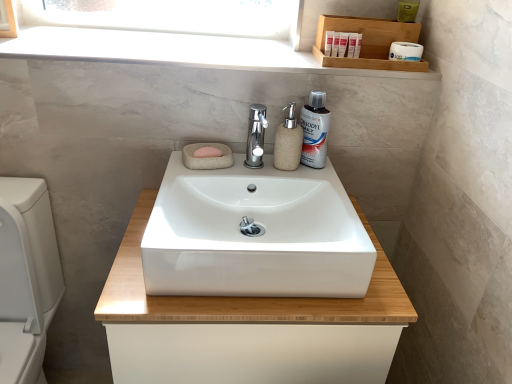
Find the location of a particular element. This screenshot has height=384, width=512. blank space to the left of white plastic tubes at upper right, which is the first toiletry in right-to-left order is located at coordinates (294, 57).